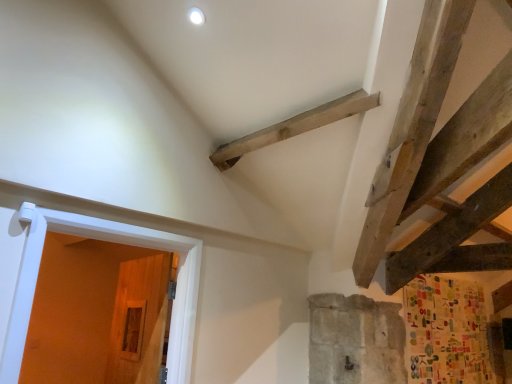
Question: Considering the positions of white painted wood door at left, which is the second door from back to front, and wooden door at lower left, positioned as the 2th door in front-to-back order, in the image, is white painted wood door at left, which is the second door from back to front, bigger or smaller than wooden door at lower left, positioned as the 2th door in front-to-back order,?

Choices:
 (A) small
 (B) big

Answer: (B)

Question: Is white painted wood door at left, the first door from the front, inside or outside of wooden door at lower left, positioned as the 2th door in front-to-back order?

Choices:
 (A) inside
 (B) outside

Answer: (B)

Question: From the image's perspective, is white painted wood door at left, the first door from the front, positioned above or below wooden door at lower left, positioned as the 2th door in front-to-back order?

Choices:
 (A) above
 (B) below

Answer: (A)

Question: Looking at their shapes, would you say wooden door at lower left, which is counted as the first door, starting from the back, is wider or thinner than white painted wood door at left, the first door from the front?

Choices:
 (A) thin
 (B) wide

Answer: (B)

Question: From the image's perspective, is wooden door at lower left, which is counted as the first door, starting from the back, positioned above or below white painted wood door at left, the first door from the front?

Choices:
 (A) above
 (B) below

Answer: (B)

Question: From their relative heights in the image, would you say wooden door at lower left, which is counted as the first door, starting from the back, is taller or shorter than white painted wood door at left, the first door from the front?

Choices:
 (A) tall
 (B) short

Answer: (A)

Question: Based on their positions, is wooden door at lower left, positioned as the 2th door in front-to-back order, located to the left or right of white painted wood door at left, the first door from the front?

Choices:
 (A) left
 (B) right

Answer: (A)